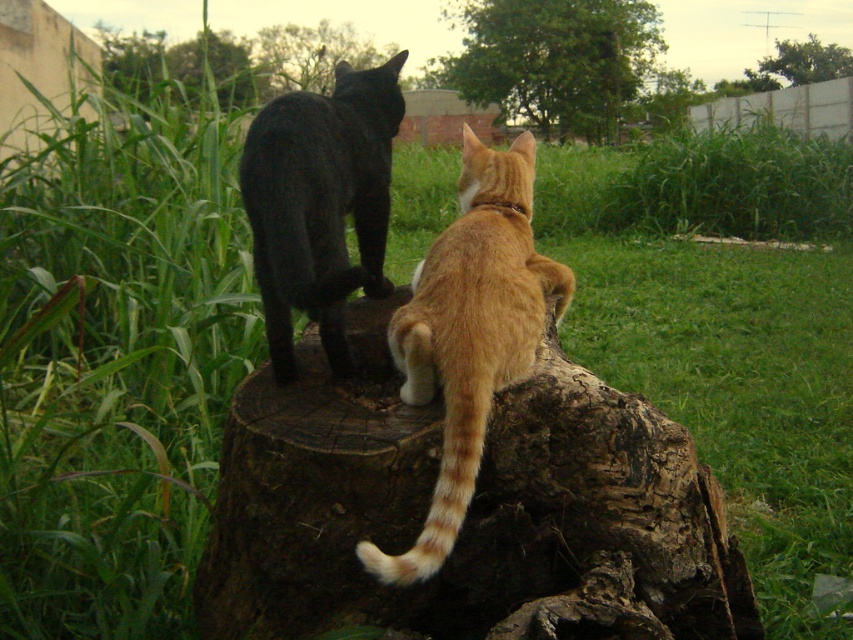
Which is behind, point (410, 580) or point (331, 188)?

Positioned behind is point (331, 188).

Is point (460, 266) more distant than point (383, 86)?

No, it is in front of (383, 86).

The width and height of the screenshot is (853, 640). I want to click on orange tabby cat at center, so click(469, 333).

Between brown rough tree trunk at center and orange tabby cat at center, which one has less height?

brown rough tree trunk at center

You are a GUI agent. You are given a task and a screenshot of the screen. Output one action in this format:
    pyautogui.click(x=<x>, y=<y>)
    Task: Click on the brown rough tree trunk at center
    Image resolution: width=853 pixels, height=640 pixels.
    Given the screenshot: What is the action you would take?
    click(x=467, y=512)

Where is `brown rough tree trunk at center`? The image size is (853, 640). brown rough tree trunk at center is located at coordinates (467, 512).

Between point (577, 381) and point (343, 150), which one is positioned behind?

The point (343, 150) is behind.

Is brown rough tree trunk at center smaller than black glossy cat at upper center?

Incorrect, brown rough tree trunk at center is not smaller in size than black glossy cat at upper center.

The image size is (853, 640). Describe the element at coordinates (467, 512) in the screenshot. I see `brown rough tree trunk at center` at that location.

I want to click on brown rough tree trunk at center, so click(467, 512).